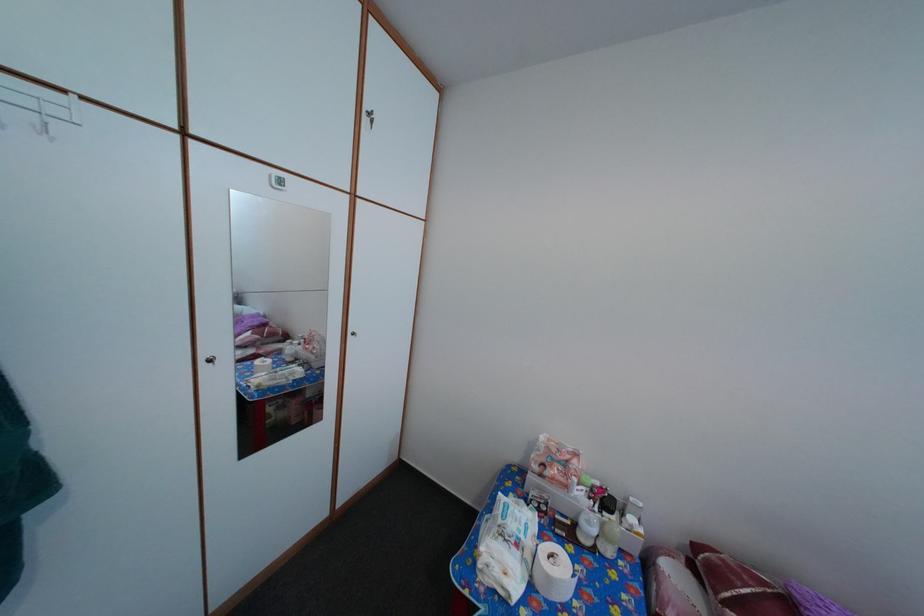
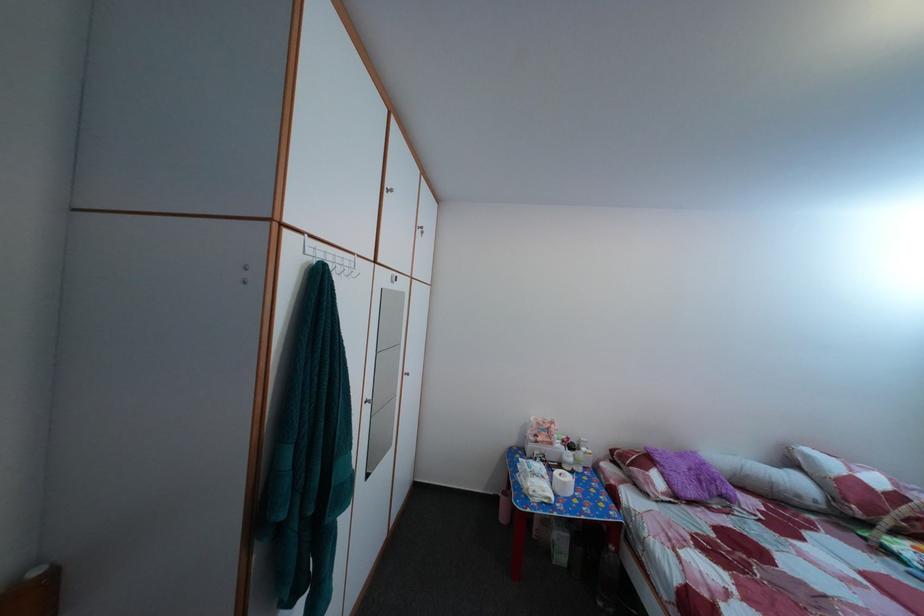
Find the pixel in the second image that matches point (613, 498) in the first image.

(578, 447)